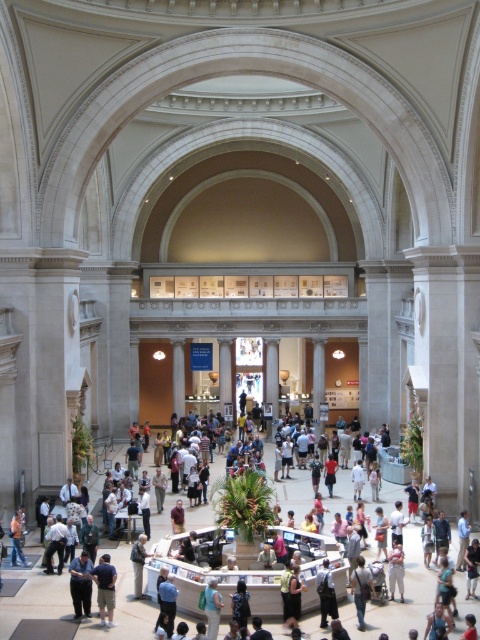
Between denim pants at center and dark gray shirt at center, which one has more height?

Standing taller between the two is dark gray shirt at center.

Looking at this image, measure the distance from denim pants at center to dark gray shirt at center.

denim pants at center is 51.69 feet away from dark gray shirt at center.

Measure the distance between denim pants at center and camera.

denim pants at center is 43.81 meters away from camera.

This screenshot has height=640, width=480. Identify the location of denim pants at center. (360, 588).

Consider the image. Does light brown leather jacket at center have a smaller size compared to denim pants at center?

No.

Can you confirm if light brown leather jacket at center is shorter than denim pants at center?

Incorrect, light brown leather jacket at center's height does not fall short of denim pants at center's.

Does point (131, 604) lie in front of point (371, 586)?

No.

Identify the location of light brown leather jacket at center. (397, 598).

Does point (72, 596) come in front of point (332, 593)?

No, (72, 596) is behind (332, 593).

Can you confirm if dark gray pants at lower left is positioned below light blue jeans at center?

No, dark gray pants at lower left is not below light blue jeans at center.

Which is behind, point (81, 611) or point (323, 566)?

Point (323, 566)

You are a GUI agent. You are given a task and a screenshot of the screen. Output one action in this format:
    pyautogui.click(x=<x>, y=<y>)
    Task: Click on the dark gray pants at lower left
    
    Given the screenshot: What is the action you would take?
    pyautogui.click(x=81, y=582)